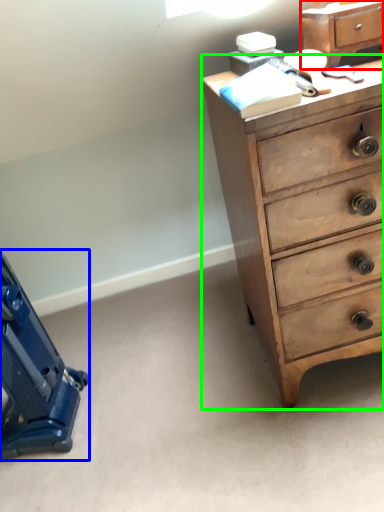
Question: Based on their relative distances, which object is nearer to file cabinet (highlighted by a red box)? Choose from equipment (highlighted by a blue box) and chest of drawers (highlighted by a green box).

Choices:
 (A) equipment
 (B) chest of drawers

Answer: (B)